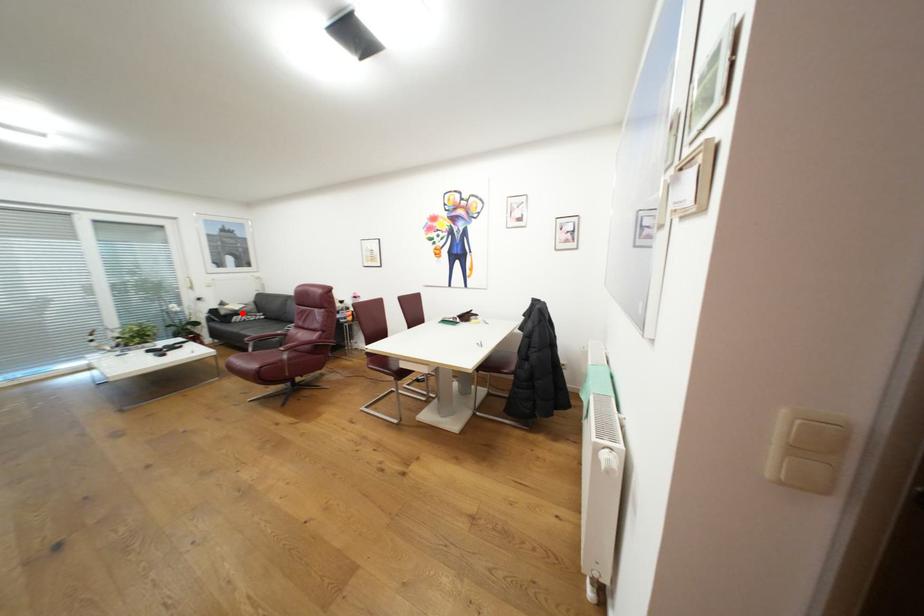
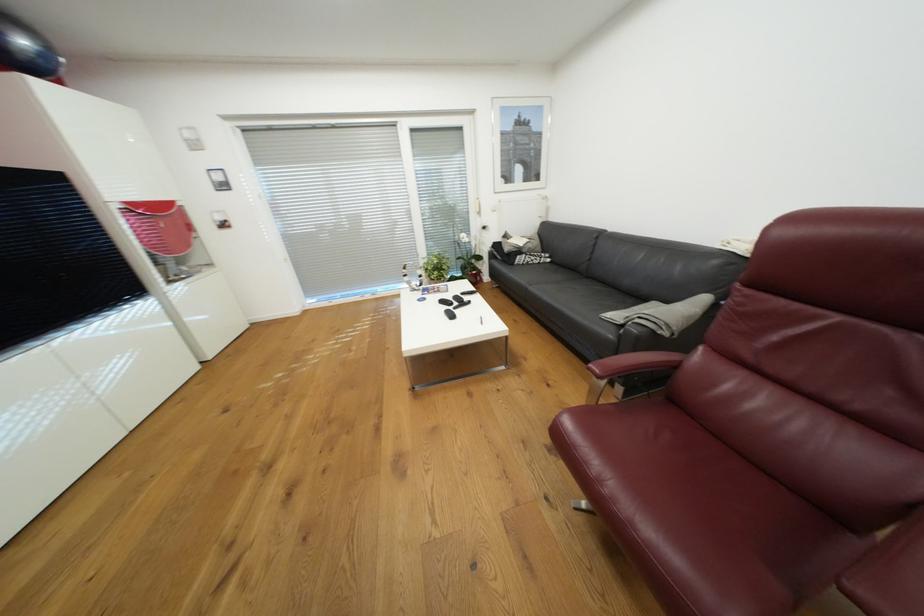
The point at the highlighted location is marked in the first image. Where is the corresponding point in the second image?

(526, 252)